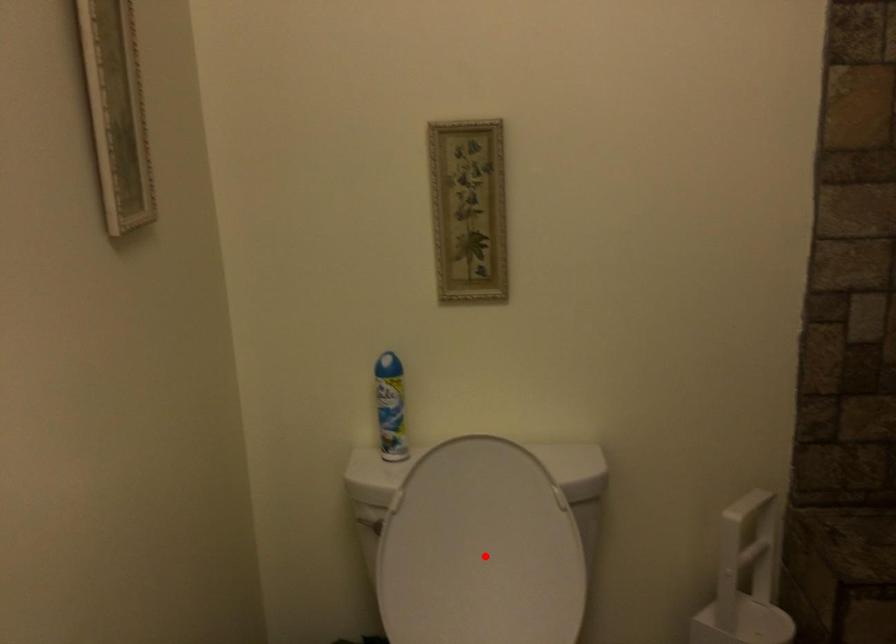
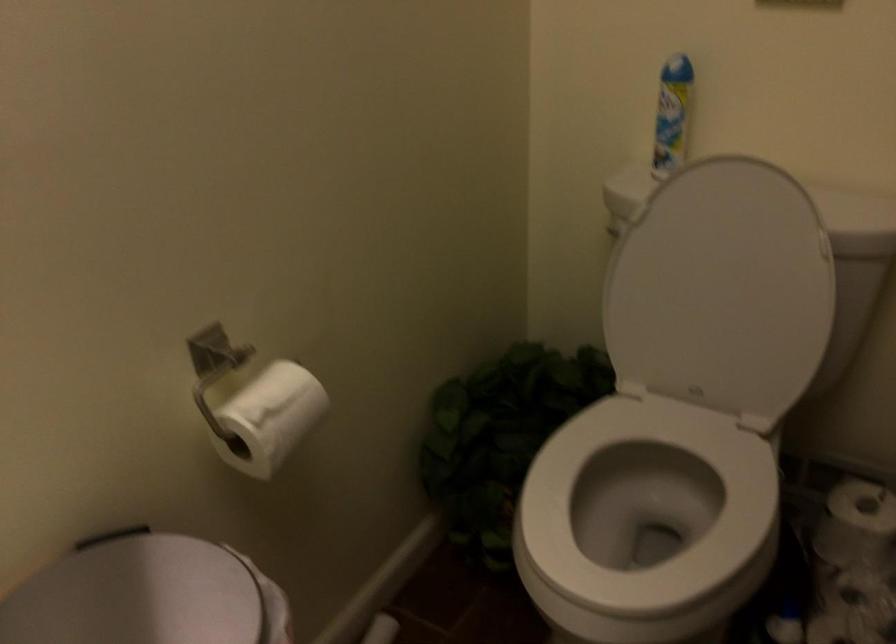
Locate, in the second image, the point that corresponds to the highlighted location in the first image.

(721, 289)